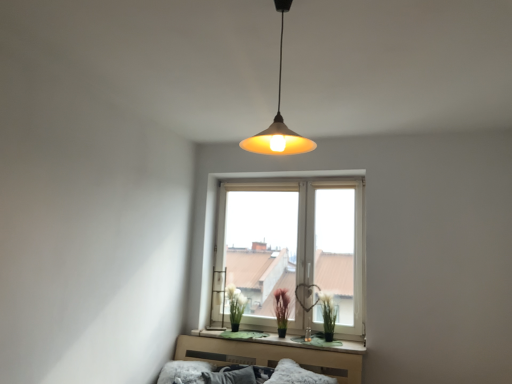
Find the location of a particular element. Image resolution: width=512 pixels, height=384 pixels. vacant area that is situated to the right of green matte plant at window, which is the 2th plant in left-to-right order is located at coordinates (x=351, y=340).